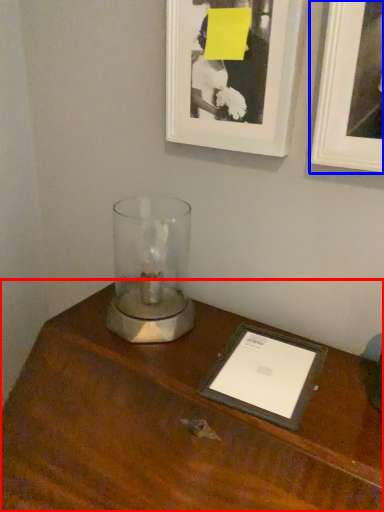
Question: Which point is closer to the camera, table (highlighted by a red box) or picture frame (highlighted by a blue box)?

Choices:
 (A) table
 (B) picture frame

Answer: (A)